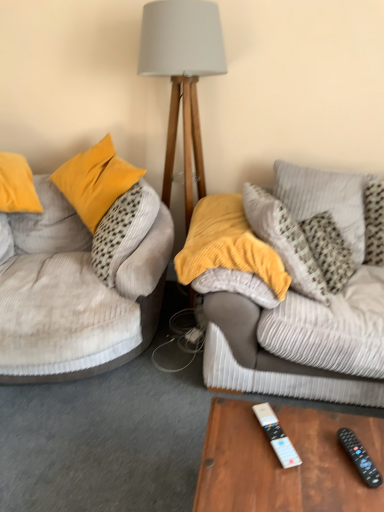
Where is `vacant space situated on the left part of white plastic remote control at lower center, which appears as the second remote control when viewed from the right`? vacant space situated on the left part of white plastic remote control at lower center, which appears as the second remote control when viewed from the right is located at coordinates (231, 442).